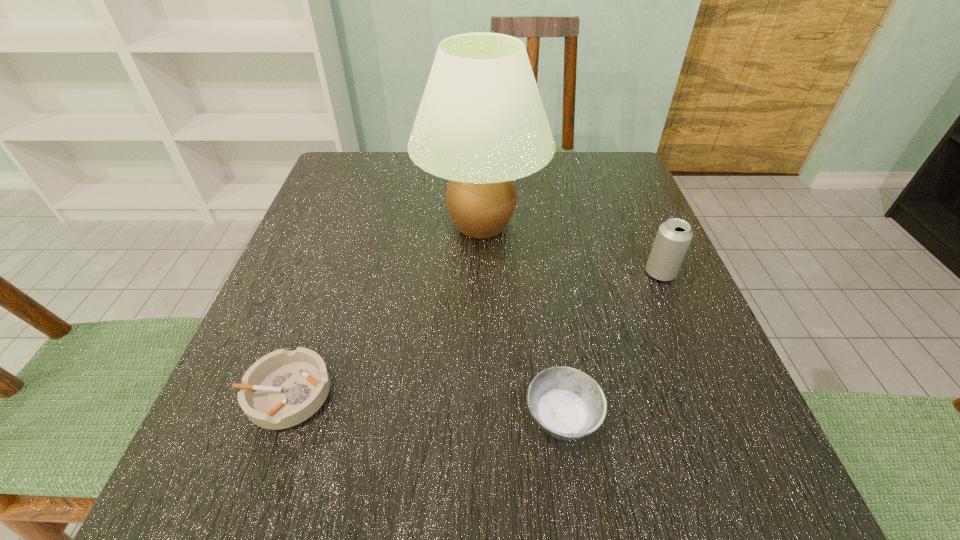
The height and width of the screenshot is (540, 960). In the image, there is a desktop. Find the location of `free space at the right edge`. free space at the right edge is located at coordinates (690, 348).

Find the location of `vacant region at the far left corner`. vacant region at the far left corner is located at coordinates (386, 197).

The image size is (960, 540). Find the location of `free area in between the leftmost object and the lampshade`. free area in between the leftmost object and the lampshade is located at coordinates (384, 309).

Find the location of a particular element. free space that is in between the taller ashtray and the lampshade is located at coordinates (522, 321).

This screenshot has width=960, height=540. What are the coordinates of `free space between the lampshade and the third shortest object` in the screenshot? It's located at (571, 248).

Locate an element on the screen. The height and width of the screenshot is (540, 960). empty location between the second tallest object and the right ashtray is located at coordinates (612, 345).

Find the location of `blank region between the left ashtray and the third tallest object`. blank region between the left ashtray and the third tallest object is located at coordinates (424, 405).

Locate an element on the screen. vacant space that is in between the lampshade and the right ashtray is located at coordinates (522, 321).

Identify the location of vacant space that's between the tallest object and the right ashtray. The height and width of the screenshot is (540, 960). (522, 321).

The height and width of the screenshot is (540, 960). Identify the location of empty space between the shorter ashtray and the second shortest object. (424, 405).